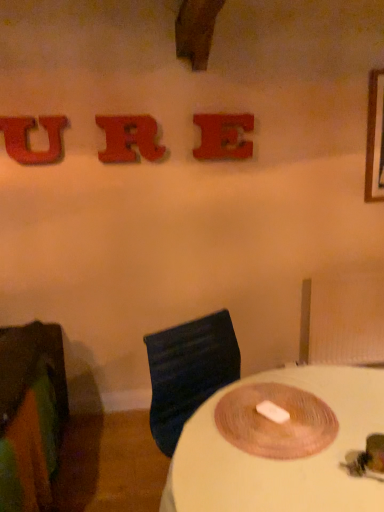
Where is `glittery red letter u at upper left, which is the first alphabet in left-to-right order`? The width and height of the screenshot is (384, 512). glittery red letter u at upper left, which is the first alphabet in left-to-right order is located at coordinates (28, 142).

Based on the photo, what is the approximate width of green fabric chair at left?

green fabric chair at left is 36.66 inches in width.

What do you see at coordinates (280, 445) in the screenshot?
I see `white matte table at center` at bounding box center [280, 445].

At what (x,y) coordinates should I click in order to perform the action: click on matte red letter e at upper center, the third alphabet from the left. Please return your answer as a coordinate pair (x, y). The width and height of the screenshot is (384, 512). Looking at the image, I should click on (224, 136).

From the image's perspective, relative to white matte table at center, is green fabric chair at left above or below?

green fabric chair at left is above white matte table at center.

The image size is (384, 512). In the image, there is a green fabric chair at left. In order to click on table below it (from a real-world perspective) in this screenshot , I will do `click(280, 445)`.

Can you confirm if green fabric chair at left is bigger than white matte table at center?

No, green fabric chair at left is not bigger than white matte table at center.

Which is behind, point (24, 461) or point (212, 421)?

The point (24, 461) is behind.

I want to click on furniture located underneath the matte red letter e at upper center, marked as the 1th alphabet in a right-to-left arrangement (from a real-world perspective), so click(x=30, y=414).

Consider the image. Is green fabric chair at left facing away from matte red letter e at upper center, the third alphabet from the left?

No, green fabric chair at left is not facing away from matte red letter e at upper center, the third alphabet from the left.

Is point (53, 357) closer or farther from the camera than point (228, 156)?

Clearly, point (53, 357) is closer to the camera than point (228, 156).

How far apart are green fabric chair at left and matte red letter e at upper center, marked as the 1th alphabet in a right-to-left arrangement?

4.64 feet.

From a real-world perspective, which is physically below, white matte table at center or green fabric chair at left?

white matte table at center.

From the image's perspective, which object appears higher, white matte table at center or green fabric chair at left?

green fabric chair at left.

Is white matte table at center facing towards green fabric chair at left?

No, white matte table at center is not turned towards green fabric chair at left.

Which point is more distant from viewer, [219,481] or [2,445]?

The point [2,445] is more distant.

Can you tell me how much rubberized red letter r at upper center, which is counted as the 2th alphabet, starting from the left, and green fabric chair at left differ in facing direction?

The facing directions of rubberized red letter r at upper center, which is counted as the 2th alphabet, starting from the left, and green fabric chair at left are 1.14 degrees apart.

You are a GUI agent. You are given a task and a screenshot of the screen. Output one action in this format:
    pyautogui.click(x=<x>, y=<y>)
    Task: Click on the 2nd alphabet above the green fabric chair at left (from the image's perspective)
    
    Given the screenshot: What is the action you would take?
    pyautogui.click(x=130, y=138)

From the image's perspective, is rubberized red letter r at upper center, which appears as the 2th alphabet when viewed from the right, positioned above or below green fabric chair at left?

rubberized red letter r at upper center, which appears as the 2th alphabet when viewed from the right, is situated higher than green fabric chair at left in the image.

From a real-world perspective, is rubberized red letter r at upper center, which appears as the 2th alphabet when viewed from the right, positioned above or below green fabric chair at left?

In terms of real-world spatial position, rubberized red letter r at upper center, which appears as the 2th alphabet when viewed from the right, is above green fabric chair at left.

Is matte red letter e at upper center, the third alphabet from the left, surrounding green fabric chair at left?

No, green fabric chair at left is located outside of matte red letter e at upper center, the third alphabet from the left.

Between point (205, 138) and point (15, 456), which one is positioned in front?

Point (15, 456)

The image size is (384, 512). What are the coordinates of `furniture in front of the matte red letter e at upper center, the third alphabet from the left` in the screenshot? It's located at (30, 414).

Considering the positions of point (305, 492) and point (50, 122), is point (305, 492) closer or farther from the camera than point (50, 122)?

Clearly, point (305, 492) is closer to the camera than point (50, 122).

From a real-world perspective, is white matte table at center physically above glittery red letter u at upper left, which is the first alphabet in left-to-right order?

No.

From the image's perspective, is white matte table at center beneath glittery red letter u at upper left, which is the first alphabet in left-to-right order?

Yes, from the image's perspective, white matte table at center is below glittery red letter u at upper left, which is the first alphabet in left-to-right order.

Is white matte table at center with glittery red letter u at upper left, which appears as the third alphabet when viewed from the right?

No, white matte table at center is not in contact with glittery red letter u at upper left, which appears as the third alphabet when viewed from the right.

Does white matte table at center appear on the right side of rubberized red letter r at upper center, which is counted as the 2th alphabet, starting from the left?

Yes, white matte table at center is to the right of rubberized red letter r at upper center, which is counted as the 2th alphabet, starting from the left.

From the image's perspective, which is below, white matte table at center or rubberized red letter r at upper center, which appears as the 2th alphabet when viewed from the right?

From the image's view, white matte table at center is below.

Which of these two, white matte table at center or rubberized red letter r at upper center, which appears as the 2th alphabet when viewed from the right, is bigger?

Bigger between the two is white matte table at center.

Based on the photo, does white matte table at center turn towards rubberized red letter r at upper center, which appears as the 2th alphabet when viewed from the right?

No, white matte table at center is not turned towards rubberized red letter r at upper center, which appears as the 2th alphabet when viewed from the right.

Identify the location of furniture on the left of white matte table at center. (30, 414).

You are a GUI agent. You are given a task and a screenshot of the screen. Output one action in this format:
    pyautogui.click(x=<x>, y=<y>)
    Task: Click on the furniture in front of the matte red letter e at upper center, marked as the 1th alphabet in a right-to-left arrangement
    Image resolution: width=384 pixels, height=512 pixels.
    Given the screenshot: What is the action you would take?
    pyautogui.click(x=30, y=414)

Estimate the real-world distances between objects in this image. Which object is closer to green fabric chair at left, matte red letter e at upper center, marked as the 1th alphabet in a right-to-left arrangement, or white matte table at center?

white matte table at center is positioned closer to the anchor green fabric chair at left.

In the scene shown: Considering their positions, is white matte table at center positioned closer to rubberized red letter r at upper center, which is counted as the 2th alphabet, starting from the left, than glittery red letter u at upper left, which is the first alphabet in left-to-right order?

Based on the image, glittery red letter u at upper left, which is the first alphabet in left-to-right order, appears to be nearer to rubberized red letter r at upper center, which is counted as the 2th alphabet, starting from the left.

From the image, which object appears to be nearer to rubberized red letter r at upper center, which is counted as the 2th alphabet, starting from the left, glittery red letter u at upper left, which appears as the third alphabet when viewed from the right, or green fabric chair at left?

Based on the image, glittery red letter u at upper left, which appears as the third alphabet when viewed from the right, appears to be nearer to rubberized red letter r at upper center, which is counted as the 2th alphabet, starting from the left.

Estimate the real-world distances between objects in this image. Which object is further from matte red letter e at upper center, marked as the 1th alphabet in a right-to-left arrangement, glittery red letter u at upper left, which appears as the third alphabet when viewed from the right, or rubberized red letter r at upper center, which appears as the 2th alphabet when viewed from the right?

Based on the image, glittery red letter u at upper left, which appears as the third alphabet when viewed from the right, appears to be further to matte red letter e at upper center, marked as the 1th alphabet in a right-to-left arrangement.

Looking at the image, which one is located closer to white matte table at center, green fabric chair at left or rubberized red letter r at upper center, which is counted as the 2th alphabet, starting from the left?

green fabric chair at left lies closer to white matte table at center than the other object.

When comparing their distances from matte red letter e at upper center, marked as the 1th alphabet in a right-to-left arrangement, does white matte table at center or rubberized red letter r at upper center, which appears as the 2th alphabet when viewed from the right, seem closer?

Among the two, rubberized red letter r at upper center, which appears as the 2th alphabet when viewed from the right, is located nearer to matte red letter e at upper center, marked as the 1th alphabet in a right-to-left arrangement.

Considering their positions, is white matte table at center positioned closer to rubberized red letter r at upper center, which appears as the 2th alphabet when viewed from the right, than green fabric chair at left?

green fabric chair at left.

Based on their spatial positions, is green fabric chair at left or white matte table at center closer to glittery red letter u at upper left, which is the first alphabet in left-to-right order?

Among the two, green fabric chair at left is located nearer to glittery red letter u at upper left, which is the first alphabet in left-to-right order.

You are a GUI agent. You are given a task and a screenshot of the screen. Output one action in this format:
    pyautogui.click(x=<x>, y=<y>)
    Task: Click on the furniture between rubberized red letter r at upper center, which is counted as the 2th alphabet, starting from the left, and white matte table at center, in the vertical direction
    The width and height of the screenshot is (384, 512).
    Given the screenshot: What is the action you would take?
    pyautogui.click(x=30, y=414)

Locate an element on the screen. furniture between matte red letter e at upper center, marked as the 1th alphabet in a right-to-left arrangement, and white matte table at center, in the vertical direction is located at coordinates (30, 414).

Identify the location of alphabet between rubberized red letter r at upper center, which appears as the 2th alphabet when viewed from the right, and green fabric chair at left from top to bottom. (28, 142).

I want to click on furniture between glittery red letter u at upper left, which is the first alphabet in left-to-right order, and white matte table at center, in the vertical direction, so [x=30, y=414].